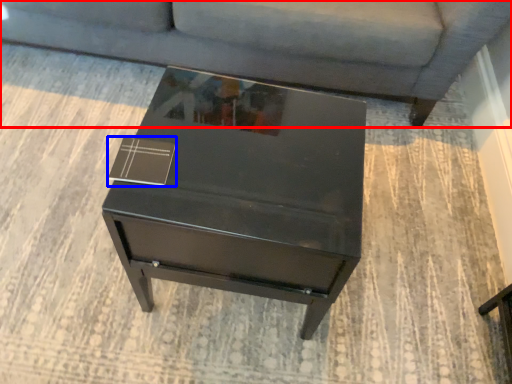
Question: Which point is further to the camera, studio couch (highlighted by a red box) or square (highlighted by a blue box)?

Choices:
 (A) studio couch
 (B) square

Answer: (A)